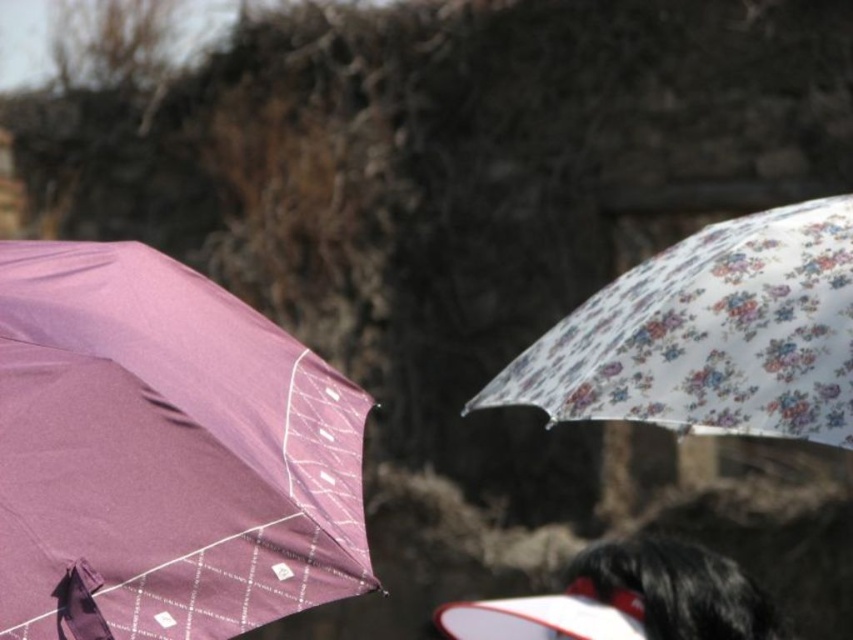
Question: Which of the following is the closest to the observer?

Choices:
 (A) [x=672, y=333]
 (B) [x=167, y=509]

Answer: (B)

Question: Is the position of purple matte umbrella at left more distant than that of black fuzzy hair at lower right?

Choices:
 (A) yes
 (B) no

Answer: (B)

Question: Can you confirm if floral printed umbrella at right is positioned below black fuzzy hair at lower right?

Choices:
 (A) yes
 (B) no

Answer: (B)

Question: Can you confirm if purple matte umbrella at left is positioned below black fuzzy hair at lower right?

Choices:
 (A) no
 (B) yes

Answer: (A)

Question: Which of these objects is positioned farthest from the floral printed umbrella at right?

Choices:
 (A) black fuzzy hair at lower right
 (B) purple matte umbrella at left

Answer: (B)

Question: Which point is farther to the camera?

Choices:
 (A) (613, 561)
 (B) (218, 416)
 (C) (492, 381)

Answer: (A)